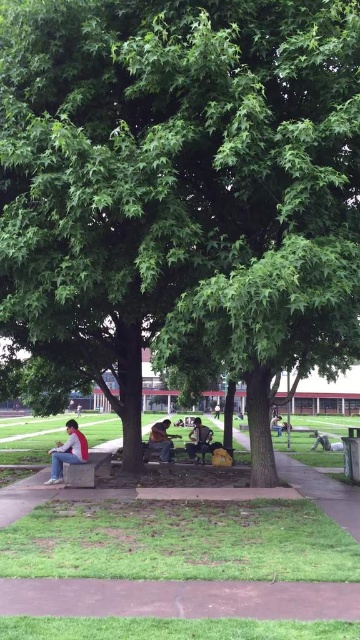
You are a delivery person carrying a large box that is 1 meter wide. You need to move along the brown dirt path at lower center but there is a dark gray fabric jacket at center in the way. Can your box fit through the path if you go around the jacket?

The brown dirt path at lower center might be wider than dark gray fabric jacket at center, so there is a possibility that the box can fit through by going around the jacket, but the exact width is uncertain.

You are planning to place the brown leather jacket at center on the concrete bench at lower center. Based on their sizes, will the jacket fit entirely on the bench?

The concrete bench at lower center is wider than the brown leather jacket at center, so the jacket will fit entirely on the bench.

You are standing at the origin point of the coordinate system in the image. The coordinate system has its origin at the bottom left corner of the image. You want to walk to the brown dirt path at lower center. What direction should you walk in?

Since the brown dirt path at lower center is located at coordinate point (180, 598), you should walk towards the right from your current position at the origin to reach it.